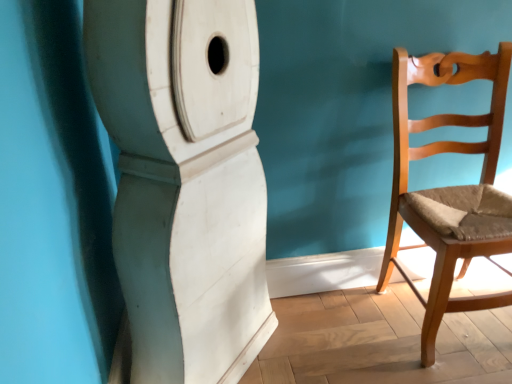
Question: Is light brown wood chair at right not within white matte pillar at center?

Choices:
 (A) yes
 (B) no

Answer: (A)

Question: From the image's perspective, is light brown wood chair at right beneath white matte pillar at center?

Choices:
 (A) yes
 (B) no

Answer: (B)

Question: Is light brown wood chair at right bigger than white matte pillar at center?

Choices:
 (A) no
 (B) yes

Answer: (A)

Question: Is light brown wood chair at right at the right side of white matte pillar at center?

Choices:
 (A) no
 (B) yes

Answer: (B)

Question: From a real-world perspective, is light brown wood chair at right below white matte pillar at center?

Choices:
 (A) no
 (B) yes

Answer: (B)

Question: Is white matte pillar at center at the back of light brown wood chair at right?

Choices:
 (A) no
 (B) yes

Answer: (A)

Question: Is white matte pillar at center shorter than light brown wood chair at right?

Choices:
 (A) no
 (B) yes

Answer: (A)

Question: Could you tell me if white matte pillar at center is facing light brown wood chair at right?

Choices:
 (A) yes
 (B) no

Answer: (A)

Question: Does white matte pillar at center have a smaller size compared to light brown wood chair at right?

Choices:
 (A) yes
 (B) no

Answer: (B)

Question: Is white matte pillar at center positioned far away from light brown wood chair at right?

Choices:
 (A) no
 (B) yes

Answer: (A)

Question: Does white matte pillar at center have a greater width compared to light brown wood chair at right?

Choices:
 (A) yes
 (B) no

Answer: (A)

Question: Is white matte pillar at center thinner than light brown wood chair at right?

Choices:
 (A) no
 (B) yes

Answer: (A)

Question: Looking at their shapes, would you say light brown wood chair at right is wider or thinner than white matte pillar at center?

Choices:
 (A) thin
 (B) wide

Answer: (A)